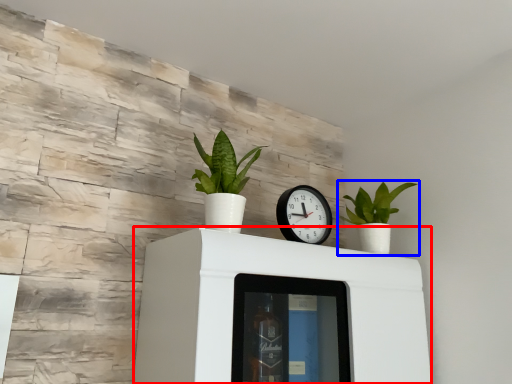
Question: Which object appears closest to the camera in this image, furniture (highlighted by a red box) or houseplant (highlighted by a blue box)?

Choices:
 (A) furniture
 (B) houseplant

Answer: (A)